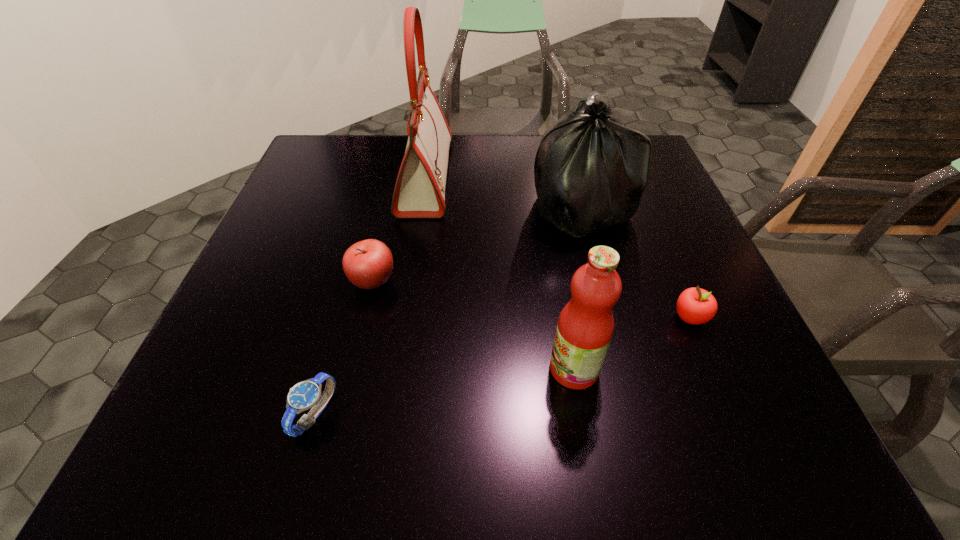
Locate an element on the screen. Image resolution: width=960 pixels, height=540 pixels. handbag is located at coordinates (419, 192).

This screenshot has width=960, height=540. In order to click on plastic bag in this screenshot , I will do [x=590, y=171].

Locate an element on the screen. fruit juice is located at coordinates (585, 327).

Identify the location of the left apple. (368, 264).

Identify the location of the third farthest object. (368, 264).

Locate an element on the screen. This screenshot has width=960, height=540. the right apple is located at coordinates (695, 306).

Where is `the shorter apple`? the shorter apple is located at coordinates (695, 306).

At what (x,y) coordinates should I click in order to perform the action: click on watch. Please return your answer as a coordinate pair (x, y). Image resolution: width=960 pixels, height=540 pixels. Looking at the image, I should click on (305, 395).

I want to click on blank space located 0.200m on the front of the tallest object, so click(x=410, y=280).

The height and width of the screenshot is (540, 960). I want to click on blank area located on the front of the plastic bag, so click(x=616, y=343).